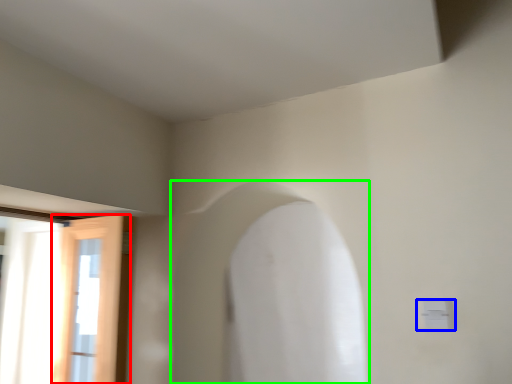
Question: Which object is positioned farthest from door (highlighted by a red box)? Select from electric outlet (highlighted by a blue box) and archway (highlighted by a green box).

Choices:
 (A) electric outlet
 (B) archway

Answer: (A)